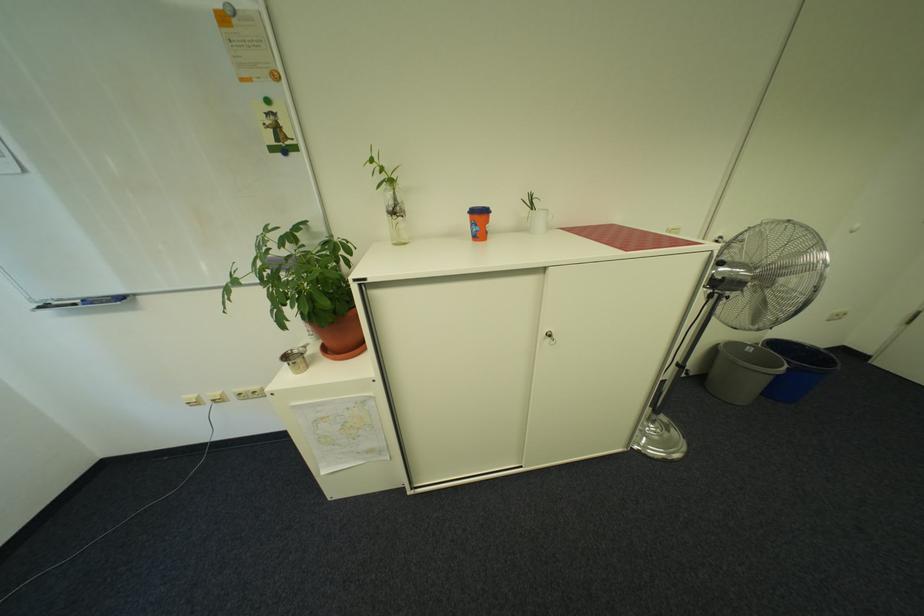
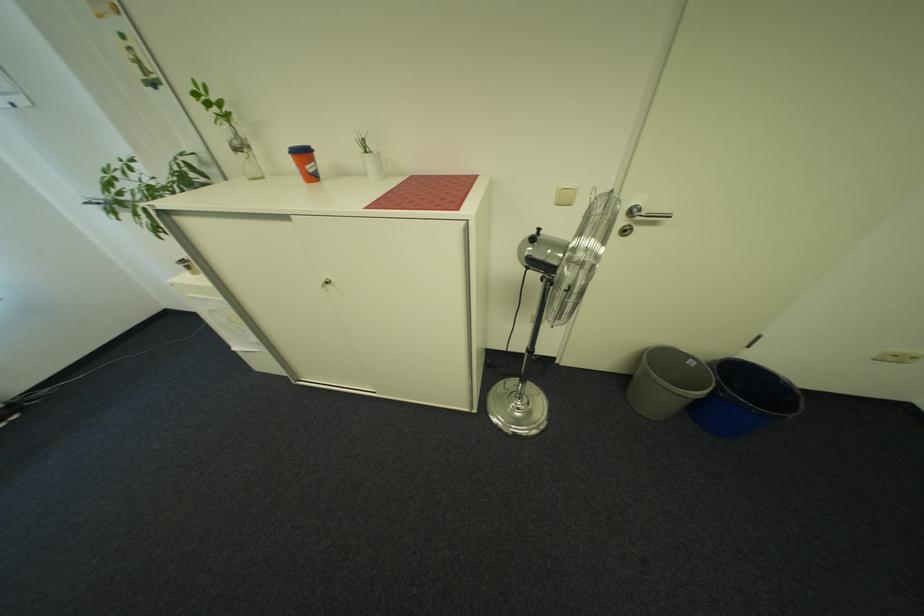
Locate, in the second image, the point that corresponds to point (411, 217) in the first image.

(252, 153)